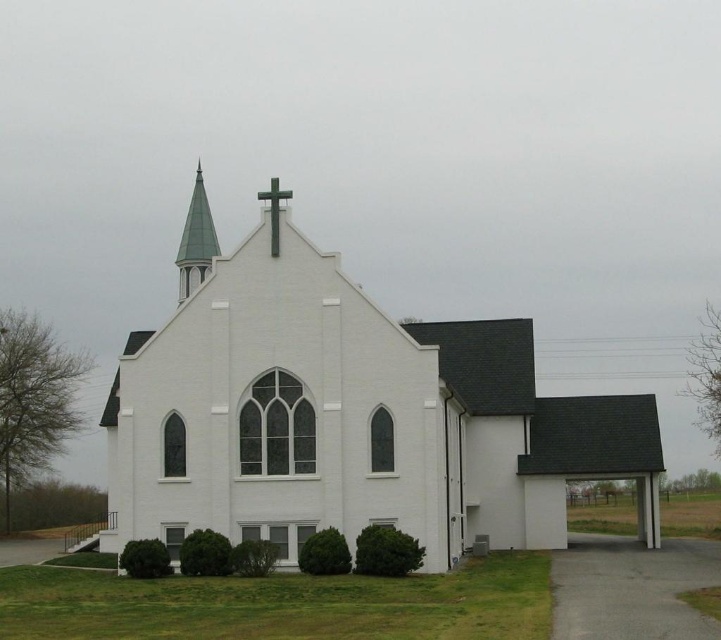
You are an architect evaluating the church design. You notice the green metallic spire at upper center and the green matte cross at upper center. Based on their positions, which object is more likely to block sunlight from reaching the stained glass window during midday?

The green metallic spire at upper center might be wider than the green matte cross at upper center, so it is more likely to block sunlight from reaching the stained glass window during midday.